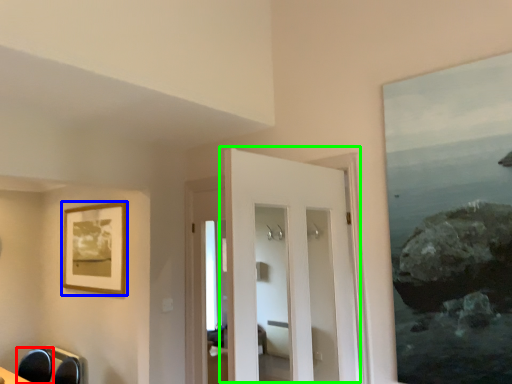
Question: Which is farther away from swivel chair (highlighted by a red box)? picture frame (highlighted by a blue box) or door (highlighted by a green box)?

Choices:
 (A) picture frame
 (B) door

Answer: (B)